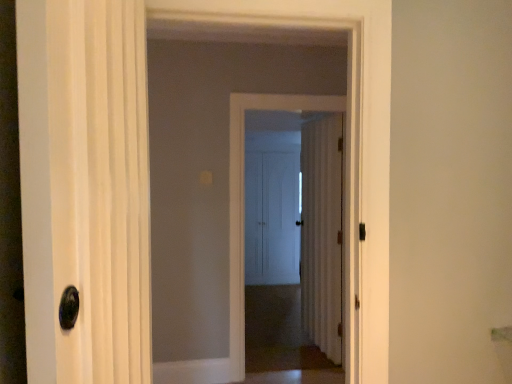
Question: Is brown carpet at center at the left side of white matte door at center, the 3th door from the back?

Choices:
 (A) yes
 (B) no

Answer: (A)

Question: Is brown carpet at center smaller than white matte door at center, the 3th door from the back?

Choices:
 (A) yes
 (B) no

Answer: (A)

Question: Is the depth of brown carpet at center greater than that of white matte door at center, which appears as the second door when viewed from the front?

Choices:
 (A) no
 (B) yes

Answer: (B)

Question: Does brown carpet at center have a larger size compared to white matte door at center, the 3th door from the back?

Choices:
 (A) no
 (B) yes

Answer: (A)

Question: From a real-world perspective, is brown carpet at center positioned under white matte door at center, the 3th door from the back, based on gravity?

Choices:
 (A) no
 (B) yes

Answer: (B)

Question: Does brown carpet at center have a greater width compared to white matte door at center, which appears as the second door when viewed from the front?

Choices:
 (A) yes
 (B) no

Answer: (A)

Question: Does white wood door at center, acting as the 3th door starting from the front, have a greater width compared to white glossy door at center?

Choices:
 (A) no
 (B) yes

Answer: (A)

Question: Considering the relative sizes of white wood door at center, which is counted as the 2th door, starting from the back, and white glossy door at center in the image provided, is white wood door at center, which is counted as the 2th door, starting from the back, bigger than white glossy door at center?

Choices:
 (A) no
 (B) yes

Answer: (A)

Question: Does white wood door at center, acting as the 3th door starting from the front, have a lesser width compared to white glossy door at center?

Choices:
 (A) no
 (B) yes

Answer: (B)

Question: From a real-world perspective, is white wood door at center, acting as the 3th door starting from the front, under white glossy door at center?

Choices:
 (A) no
 (B) yes

Answer: (B)

Question: Is white wood door at center, acting as the 3th door starting from the front, further to camera compared to white glossy door at center?

Choices:
 (A) no
 (B) yes

Answer: (B)

Question: From the image's perspective, does white wood door at center, acting as the 3th door starting from the front, appear higher than white glossy door at center?

Choices:
 (A) yes
 (B) no

Answer: (B)

Question: From the image's perspective, is white matte door at center, the fourth door from the front, below brown carpet at center?

Choices:
 (A) yes
 (B) no

Answer: (B)